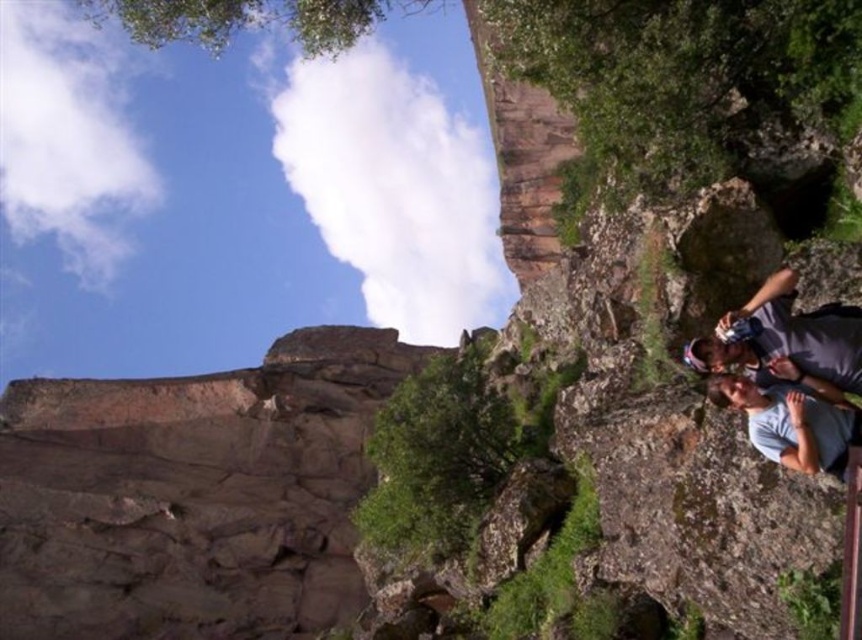
Does gray fabric shirt at lower right appear over gray cotton shirt at lower right?

Correct, gray fabric shirt at lower right is located above gray cotton shirt at lower right.

Does point (767, 346) come behind point (795, 422)?

Yes, it is behind point (795, 422).

Between point (826, 316) and point (806, 468), which one is positioned in front?

Positioned in front is point (806, 468).

The height and width of the screenshot is (640, 862). Identify the location of gray fabric shirt at lower right. (784, 339).